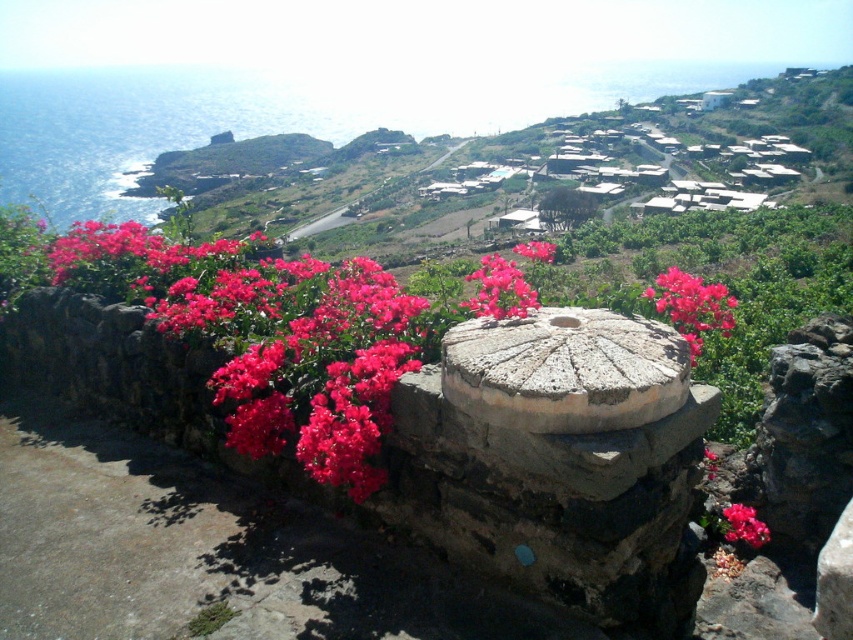
Does point (509, 324) come closer to viewer compared to point (650, 296)?

Yes, point (509, 324) is closer to viewer.

Is point (582, 420) positioned after point (701, 320)?

No, it is not.

Find the location of a particular element. gray weathered millstone at center is located at coordinates (566, 371).

Between matte pink flower at center and pink matte flower at center, which one is positioned higher?

pink matte flower at center is above.

Is matte pink flower at center thinner than pink matte flower at center?

Yes.

Which is behind, point (726, 529) or point (547, 259)?

The point (726, 529) is more distant.

Image resolution: width=853 pixels, height=640 pixels. I want to click on matte pink flower at center, so click(x=744, y=525).

Does point (674, 291) lie behind point (726, 529)?

That is False.

From the picture: Who is more distant from viewer, (704, 323) or (747, 540)?

The point (747, 540) is more distant.

This screenshot has height=640, width=853. What are the coordinates of `matte pink flowers at center` in the screenshot? It's located at (691, 307).